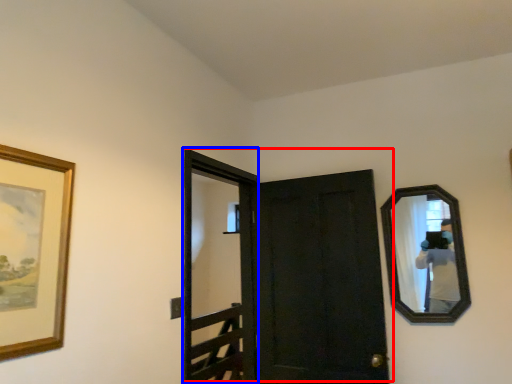
Question: Which object is closer to the camera taking this photo, door (highlighted by a red box) or screen door (highlighted by a blue box)?

Choices:
 (A) door
 (B) screen door

Answer: (B)